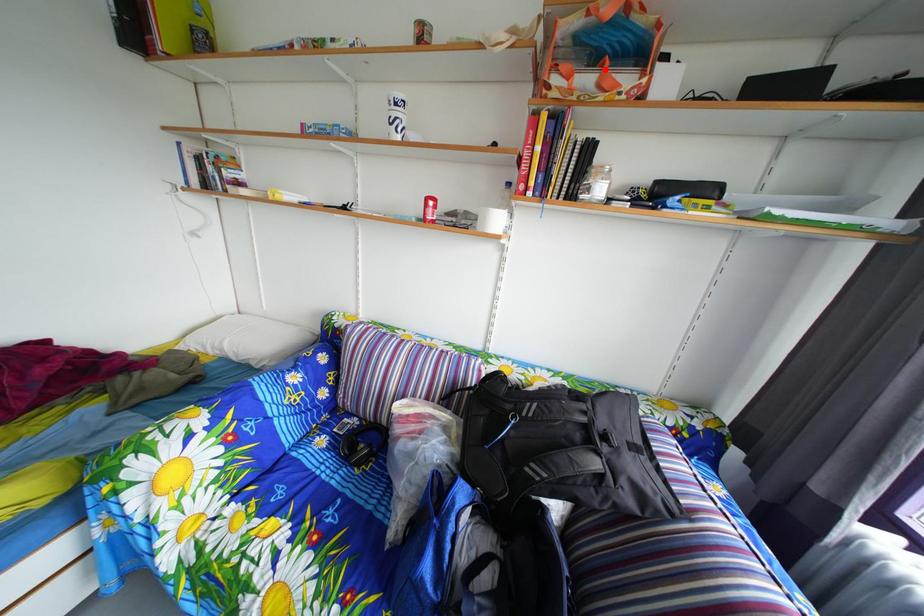
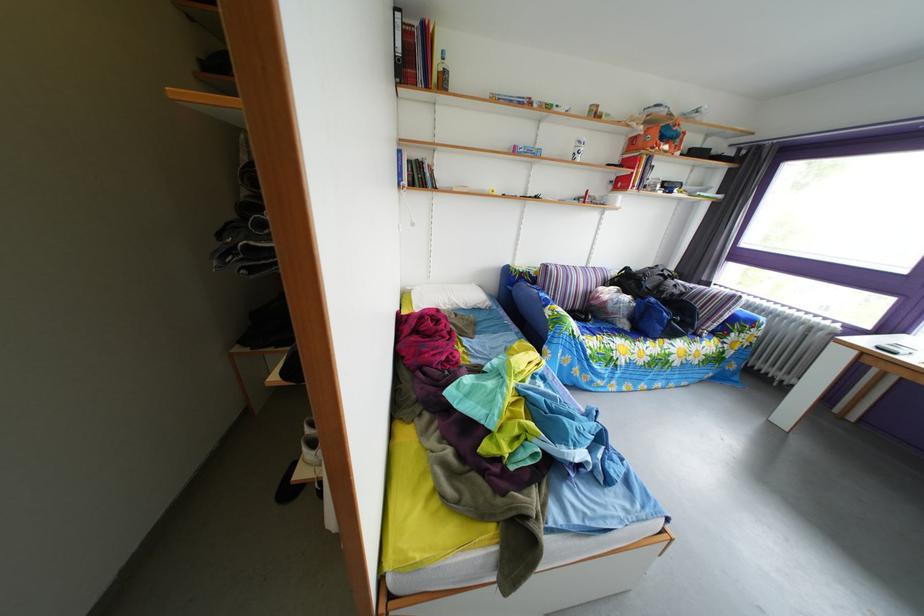
Where in the second image is the point corresponding to the highlighted location from the first image?

(673, 147)